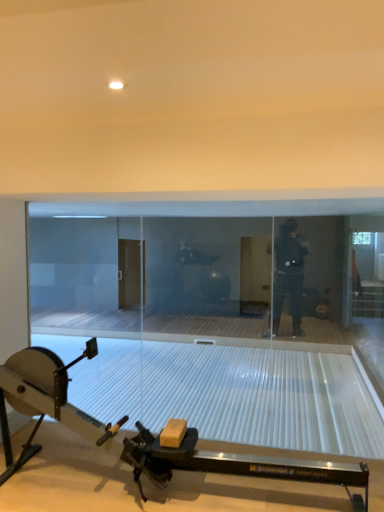
This screenshot has width=384, height=512. What do you see at coordinates (351, 254) in the screenshot?
I see `transparent glass door at center` at bounding box center [351, 254].

What is the approximate width of transparent glass door at center?

transparent glass door at center is 1.86 inches wide.

The image size is (384, 512). I want to click on transparent glass door at center, so click(351, 254).

At what (x,y) coordinates should I click in order to perform the action: click on metallic rowing machine at lower center. Please return your answer as a coordinate pair (x, y). The image size is (384, 512). Looking at the image, I should click on 144,434.

The width and height of the screenshot is (384, 512). Describe the element at coordinates (144, 434) in the screenshot. I see `metallic rowing machine at lower center` at that location.

This screenshot has height=512, width=384. Identify the location of transparent glass door at center. (351, 254).

Is metallic rowing machine at lower center at the right side of transparent glass door at center?

No, metallic rowing machine at lower center is not to the right of transparent glass door at center.

Considering their positions, is metallic rowing machine at lower center located in front of or behind transparent glass door at center?

Visually, metallic rowing machine at lower center is located in front of transparent glass door at center.

Is point (348, 468) less distant than point (366, 216)?

That is True.

From the image's perspective, which one is positioned lower, metallic rowing machine at lower center or transparent glass door at center?

metallic rowing machine at lower center, from the image's perspective.

Based on the photo, from a real-world perspective, is metallic rowing machine at lower center positioned over transparent glass door at center based on gravity?

Yes, from a real-world perspective, metallic rowing machine at lower center is on top of transparent glass door at center.

Considering the sizes of metallic rowing machine at lower center and transparent glass door at center in the image, is metallic rowing machine at lower center wider or thinner than transparent glass door at center?

In the image, metallic rowing machine at lower center appears to be wider than transparent glass door at center.

Is metallic rowing machine at lower center taller or shorter than transparent glass door at center?

Considering their sizes, metallic rowing machine at lower center has less height than transparent glass door at center.

Can you confirm if metallic rowing machine at lower center is bigger than transparent glass door at center?

Yes.

Is transparent glass door at center a part of metallic rowing machine at lower center?

That's incorrect, transparent glass door at center is not inside metallic rowing machine at lower center.

Are metallic rowing machine at lower center and transparent glass door at center beside each other?

They are not placed beside each other.

Could you tell me if metallic rowing machine at lower center is turned towards transparent glass door at center?

No, metallic rowing machine at lower center does not turn towards transparent glass door at center.

Find the location of `glass door below the metallic rowing machine at lower center (from a real-world perspective)`. glass door below the metallic rowing machine at lower center (from a real-world perspective) is located at coordinates (351, 254).

Between transparent glass door at center and metallic rowing machine at lower center, which one appears on the right side from the viewer's perspective?

transparent glass door at center is more to the right.

Is the depth of transparent glass door at center greater than that of metallic rowing machine at lower center?

Yes, transparent glass door at center is further from the viewer.

Which is closer to the camera, (348, 244) or (173, 456)?

Point (348, 244) is farther from the camera than point (173, 456).

From the image's perspective, would you say transparent glass door at center is positioned over metallic rowing machine at lower center?

Correct, transparent glass door at center appears higher than metallic rowing machine at lower center in the image.

From a real-world perspective, is transparent glass door at center positioned above or below metallic rowing machine at lower center?

transparent glass door at center is situated lower than metallic rowing machine at lower center in the real world.

Is transparent glass door at center thinner than metallic rowing machine at lower center?

Yes, transparent glass door at center is thinner than metallic rowing machine at lower center.

Considering the relative sizes of transparent glass door at center and metallic rowing machine at lower center in the image provided, is transparent glass door at center shorter than metallic rowing machine at lower center?

No.

Which of these two, transparent glass door at center or metallic rowing machine at lower center, is bigger?

metallic rowing machine at lower center.

Would you say transparent glass door at center contains metallic rowing machine at lower center?

No.

Would you say transparent glass door at center is a long distance from metallic rowing machine at lower center?

That's right, there is a large distance between transparent glass door at center and metallic rowing machine at lower center.

Is transparent glass door at center positioned with its back to metallic rowing machine at lower center?

No, transparent glass door at center is not facing away from metallic rowing machine at lower center.

How many degrees apart are the facing directions of transparent glass door at center and metallic rowing machine at lower center?

0.0336 degrees separate the facing orientations of transparent glass door at center and metallic rowing machine at lower center.

In the image, there is a metallic rowing machine at lower center. Identify the location of glass door below it (from a real-world perspective). (351, 254).

Find the location of a particular element. This screenshot has height=512, width=384. sport equipment that appears on the left of transparent glass door at center is located at coordinates (144, 434).

In the image, there is a metallic rowing machine at lower center. At what (x,y) coordinates should I click in order to perform the action: click on glass door below it (from a real-world perspective). Please return your answer as a coordinate pair (x, y). The height and width of the screenshot is (512, 384). Looking at the image, I should click on (351, 254).